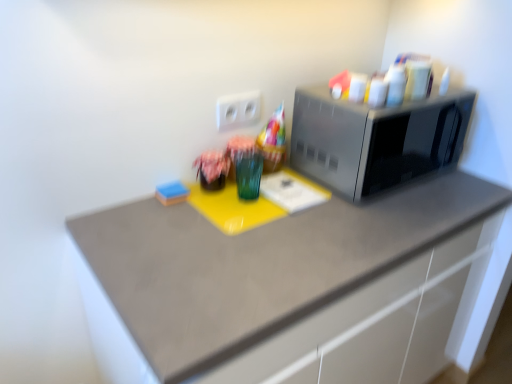
Where is `free space to the left of blue sponge at lower left`? The width and height of the screenshot is (512, 384). free space to the left of blue sponge at lower left is located at coordinates (122, 209).